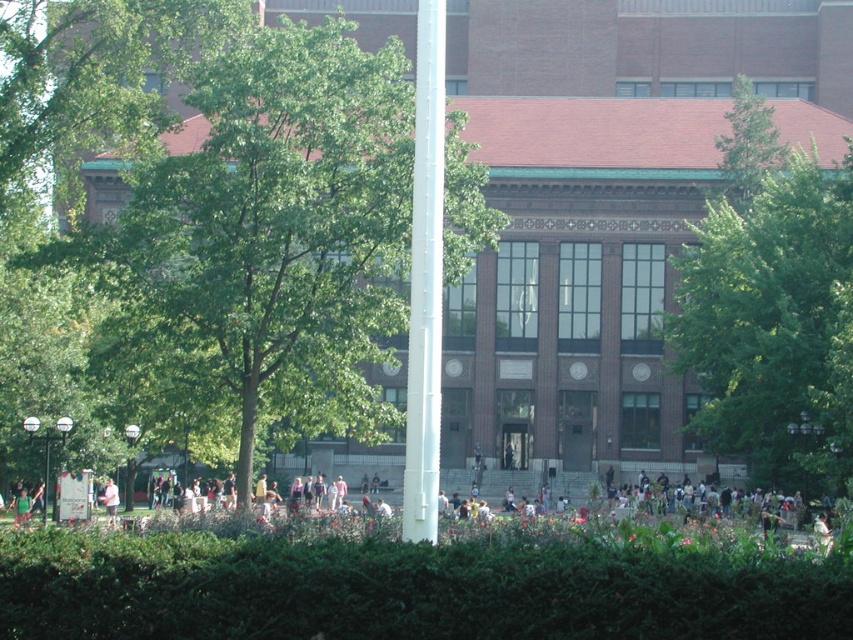
Between point (425, 612) and point (132, 465), which one is positioned behind?

The point (132, 465) is behind.

Does green leafy hedge at center have a greater width compared to white metal pole at center?

Yes.

Which is behind, point (738, 620) or point (125, 477)?

Positioned behind is point (125, 477).

This screenshot has height=640, width=853. Find the location of `green leafy hedge at center`. green leafy hedge at center is located at coordinates (407, 589).

Does green leafy hedge at center have a smaller size compared to green leafy tree at upper left?

Indeed, green leafy hedge at center has a smaller size compared to green leafy tree at upper left.

Can you confirm if green leafy hedge at center is thinner than green leafy tree at upper left?

Indeed, green leafy hedge at center has a lesser width compared to green leafy tree at upper left.

The image size is (853, 640). I want to click on green leafy hedge at center, so click(407, 589).

Who is more distant from viewer, [498,544] or [36,422]?

The point [36,422] is behind.

Does green leafy hedge at center come in front of white glossy lamp post at left?

Yes, green leafy hedge at center is closer to the viewer.

Is point (724, 625) closer to camera compared to point (47, 442)?

Yes, it is.

You are a GUI agent. You are given a task and a screenshot of the screen. Output one action in this format:
    pyautogui.click(x=<x>, y=<y>)
    Task: Click on the green leafy hedge at center
    
    Given the screenshot: What is the action you would take?
    pyautogui.click(x=407, y=589)